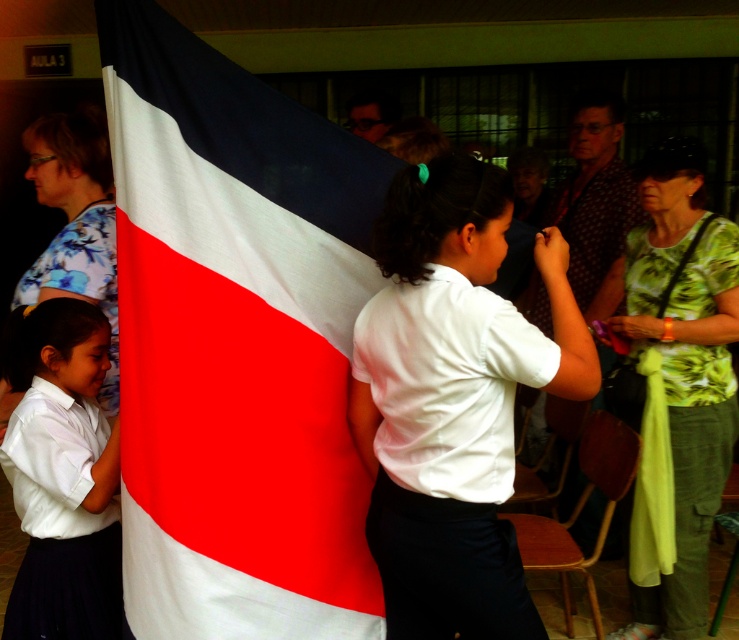
Question: Does textured fabric flag at center come in front of green floral shirt at upper right?

Choices:
 (A) yes
 (B) no

Answer: (A)

Question: Can you confirm if textured fabric flag at center is thinner than patterned fabric shirt at center?

Choices:
 (A) yes
 (B) no

Answer: (B)

Question: Among these points, which one is farthest from the camera?

Choices:
 (A) (531, 307)
 (B) (126, 440)

Answer: (A)

Question: Which of the following is the farthest from the observer?

Choices:
 (A) (571, 224)
 (B) (24, 429)
 (C) (367, 198)
 (D) (486, 436)

Answer: (A)

Question: Which of the following is the farthest from the observer?

Choices:
 (A) (4, 403)
 (B) (619, 307)
 (C) (88, 429)

Answer: (B)

Question: Is white matte uniform at center positioned before floral fabric blouse at left?

Choices:
 (A) yes
 (B) no

Answer: (A)